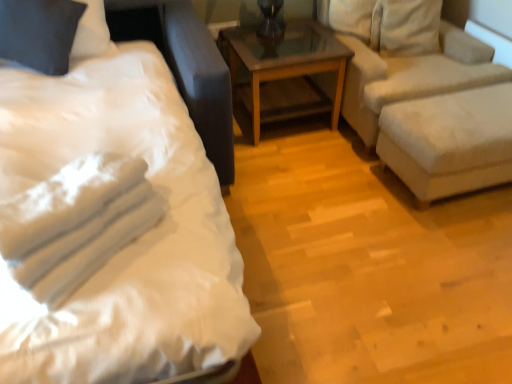
Question: Is dark gray fabric pillow at upper left bigger than white fabric ottoman at right?

Choices:
 (A) yes
 (B) no

Answer: (B)

Question: Can you confirm if dark gray fabric pillow at upper left is wider than white fabric ottoman at right?

Choices:
 (A) yes
 (B) no

Answer: (B)

Question: From a real-world perspective, is dark gray fabric pillow at upper left physically below white fabric ottoman at right?

Choices:
 (A) no
 (B) yes

Answer: (A)

Question: Does dark gray fabric pillow at upper left have a lesser height compared to white fabric ottoman at right?

Choices:
 (A) no
 (B) yes

Answer: (B)

Question: Can you confirm if dark gray fabric pillow at upper left is positioned to the right of white fabric ottoman at right?

Choices:
 (A) no
 (B) yes

Answer: (A)

Question: Based on their sizes in the image, would you say white fabric ottoman at right is bigger or smaller than brown wooden table at center?

Choices:
 (A) small
 (B) big

Answer: (A)

Question: Is white fabric ottoman at right spatially inside brown wooden table at center, or outside of it?

Choices:
 (A) inside
 (B) outside

Answer: (B)

Question: Considering the positions of point (456, 180) and point (324, 44), is point (456, 180) closer or farther from the camera than point (324, 44)?

Choices:
 (A) farther
 (B) closer

Answer: (B)

Question: In terms of height, does white fabric ottoman at right look taller or shorter compared to brown wooden table at center?

Choices:
 (A) tall
 (B) short

Answer: (B)

Question: From the image's perspective, is dark gray fabric pillow at upper left located above or below white satin bed at left?

Choices:
 (A) above
 (B) below

Answer: (A)

Question: Which is correct: dark gray fabric pillow at upper left is inside white satin bed at left, or outside of it?

Choices:
 (A) inside
 (B) outside

Answer: (A)

Question: Based on their sizes in the image, would you say dark gray fabric pillow at upper left is bigger or smaller than white satin bed at left?

Choices:
 (A) big
 (B) small

Answer: (B)

Question: Looking at their shapes, would you say dark gray fabric pillow at upper left is wider or thinner than white satin bed at left?

Choices:
 (A) wide
 (B) thin

Answer: (B)

Question: Is white cotton towels at left taller or shorter than white fabric ottoman at right?

Choices:
 (A) tall
 (B) short

Answer: (B)

Question: Considering their positions, is white cotton towels at left located in front of or behind white fabric ottoman at right?

Choices:
 (A) front
 (B) behind

Answer: (A)